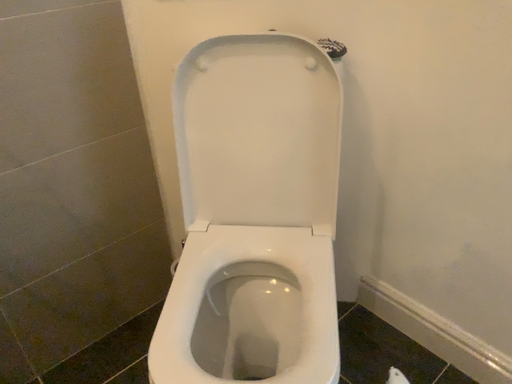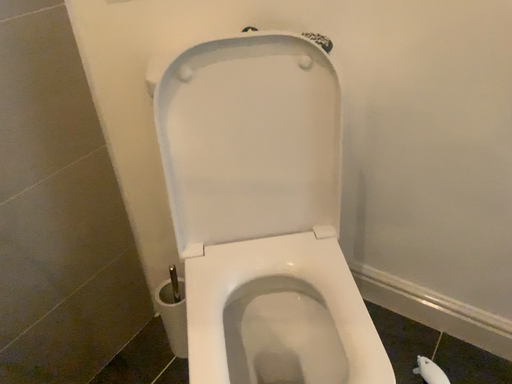
Question: Which way did the camera rotate in the video?

Choices:
 (A) rotated left
 (B) rotated right

Answer: (B)